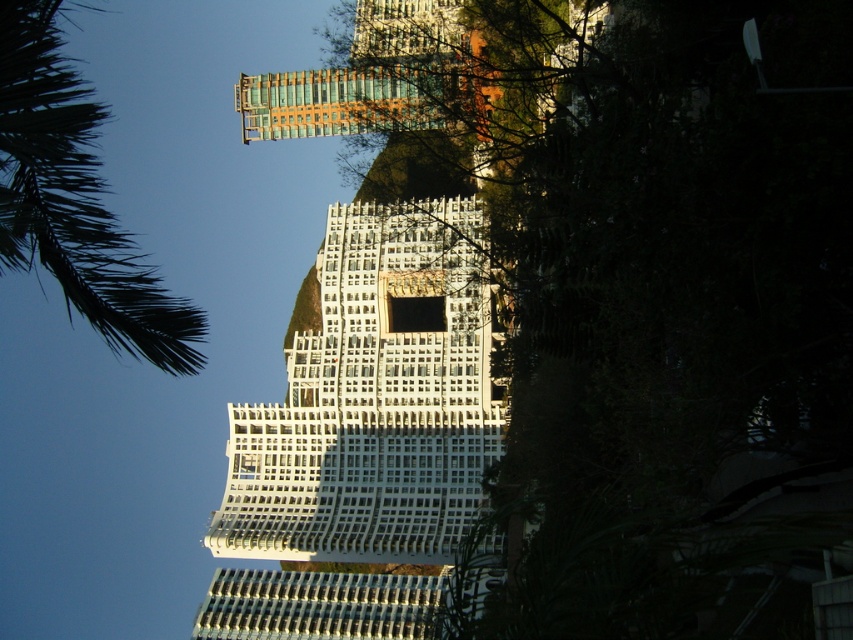
You are a drone operator flying over a city. You need to deliver a package to the white glass building at center. To avoid hitting the green leafy palm tree at upper left, should you adjust your flight path to the left or right?

The white glass building at center is positioned on the right side of the green leafy palm tree at upper left. To avoid hitting the tree, the drone should adjust its flight path to the right.

You are a drone operator who needs to capture aerial footage of the white glass building at center and the green leafy palm tree at upper left. Based on their sizes in the image, which object would require a closer flyby to ensure it appears large enough in the footage?

The white glass building at center is smaller than the green leafy palm tree at upper left, so the drone would need to fly closer to the white glass building at center to make it appear larger in the footage.